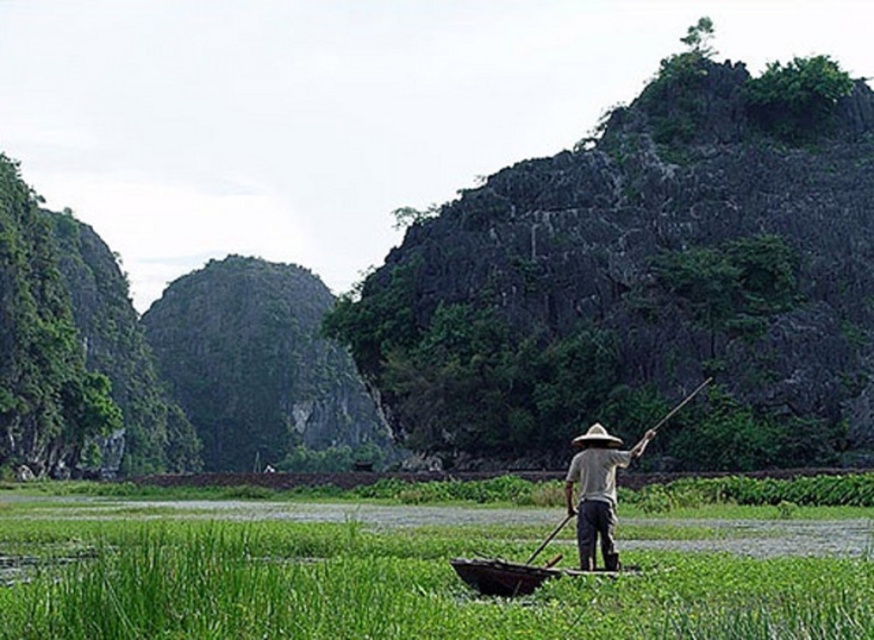
Can you confirm if green leafy vegetation at upper center is positioned below light brown straw hat at center?

Actually, green leafy vegetation at upper center is above light brown straw hat at center.

Does green leafy vegetation at upper center come behind light brown straw hat at center?

Yes, it is behind light brown straw hat at center.

Identify the location of green leafy vegetation at upper center. The height and width of the screenshot is (640, 874). (644, 278).

Can you confirm if green grass at lower center is smaller than wooden canoe at center?

No.

Between green grass at lower center and wooden canoe at center, which one appears on the left side from the viewer's perspective?

Positioned to the left is green grass at lower center.

Who is more distant from viewer, (435, 616) or (482, 573)?

The point (482, 573) is behind.

This screenshot has width=874, height=640. What are the coordinates of `green grass at lower center` in the screenshot? It's located at (415, 586).

Can you confirm if light brown straw hat at center is wider than brown straw hat at center?

Indeed, light brown straw hat at center has a greater width compared to brown straw hat at center.

Does light brown straw hat at center appear on the left side of brown straw hat at center?

Yes, light brown straw hat at center is to the left of brown straw hat at center.

What do you see at coordinates (597, 490) in the screenshot?
I see `light brown straw hat at center` at bounding box center [597, 490].

This screenshot has height=640, width=874. Find the location of `light brown straw hat at center`. light brown straw hat at center is located at coordinates (597, 490).